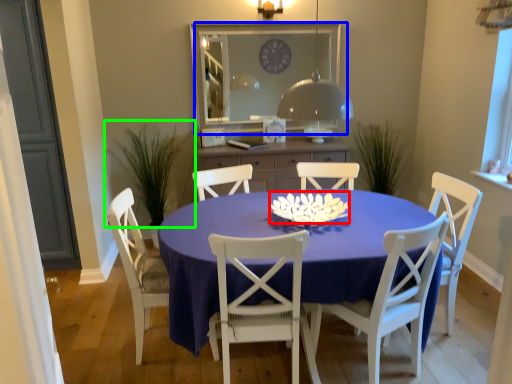
Question: Estimate the real-world distances between objects in this image. Which object is farther from flower (highlighted by a red box), window screen (highlighted by a blue box) or plant (highlighted by a green box)?

Choices:
 (A) window screen
 (B) plant

Answer: (B)